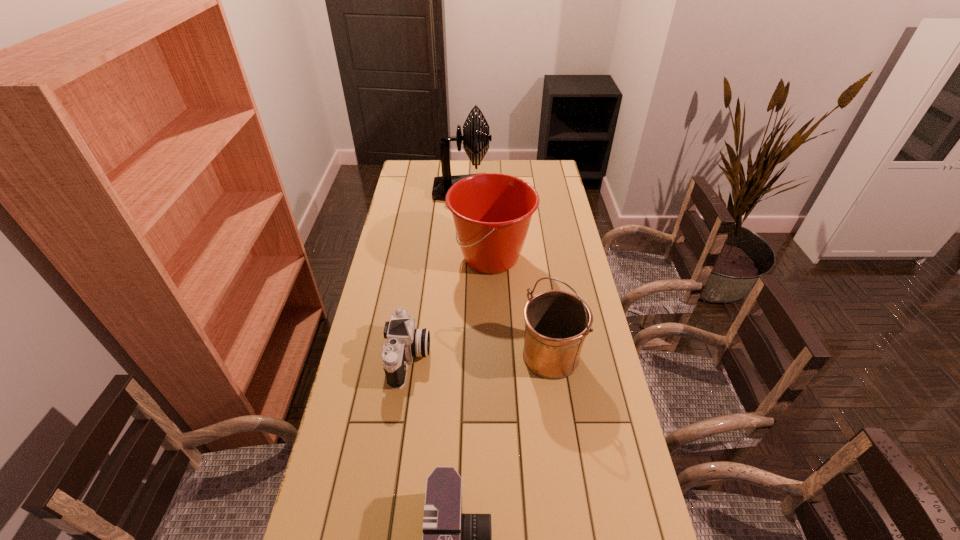
I want to click on vacant area that lies between the farther bucket and the nearer bucket, so click(x=521, y=307).

The width and height of the screenshot is (960, 540). I want to click on free space between the left camera and the second farthest object, so click(450, 308).

Identify the location of blank region between the nearer bucket and the fourth nearest object. (521, 307).

Select which object is the fourth closest to the farther camera. Please provide its 2D coordinates. Your answer should be formatted as a tuple, i.e. [(x, y)], where the tuple contains the x and y coordinates of a point satisfying the conditions above.

[(473, 138)]

Identify which object is the third closest to the nearer bucket. Please provide its 2D coordinates. Your answer should be formatted as a tuple, i.e. [(x, y)], where the tuple contains the x and y coordinates of a point satisfying the conditions above.

[(451, 539)]

Locate an element on the screen. vacant region that satisfies the following two spatial constraints: 1. with the handle attached to the rim of the farther bucket; 2. on the left side of the nearer bucket is located at coordinates (494, 356).

This screenshot has width=960, height=540. In order to click on free spot that satisfies the following two spatial constraints: 1. with the handle attached to the rim of the farther bucket; 2. on the right side of the nearer bucket in this screenshot , I will do `click(494, 356)`.

Locate an element on the screen. The width and height of the screenshot is (960, 540). free space that satisfies the following two spatial constraints: 1. in front of the farthest object to blow air; 2. on the left side of the nearer bucket is located at coordinates click(453, 356).

You are a GUI agent. You are given a task and a screenshot of the screen. Output one action in this format:
    pyautogui.click(x=<x>, y=<y>)
    Task: Click on the vacant point that satisfies the following two spatial constraints: 1. with the handle attached to the rim of the farther bucket; 2. on the right side of the nearer bucket
    
    Given the screenshot: What is the action you would take?
    pyautogui.click(x=494, y=356)